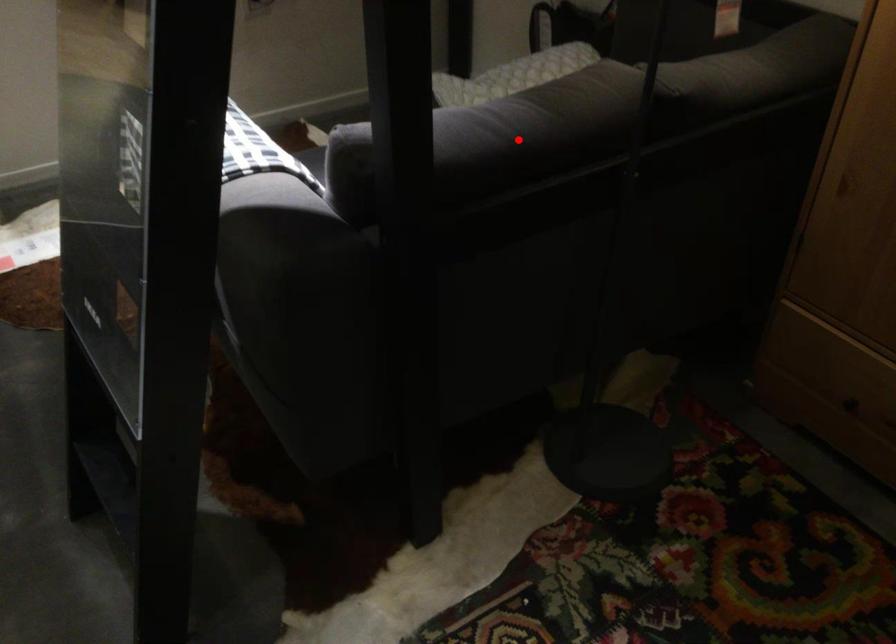
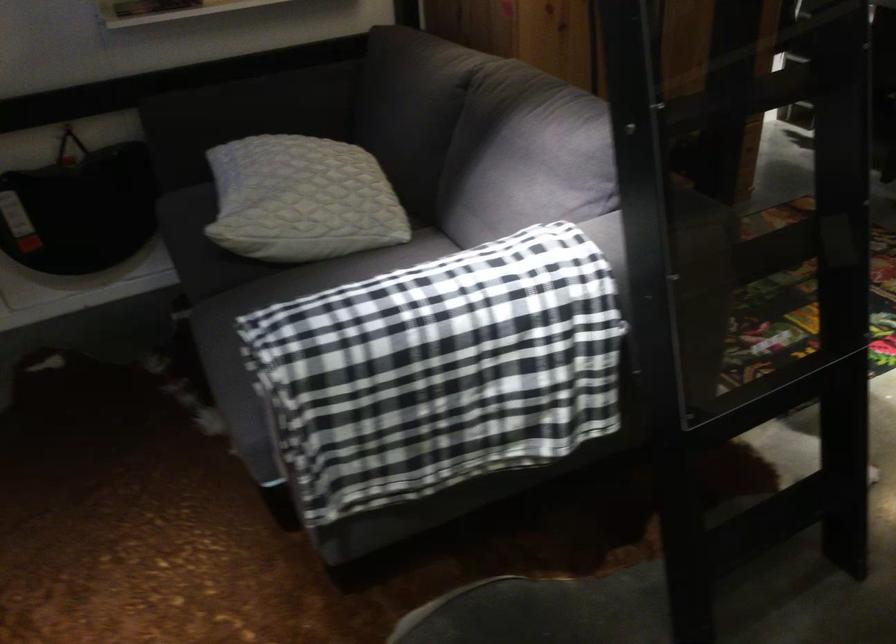
Question: I am providing you with two images of the same scene from different viewpoints. A red point is marked on the first image. Can you still see the location of the red point in image 2?

Choices:
 (A) Yes
 (B) No

Answer: (B)